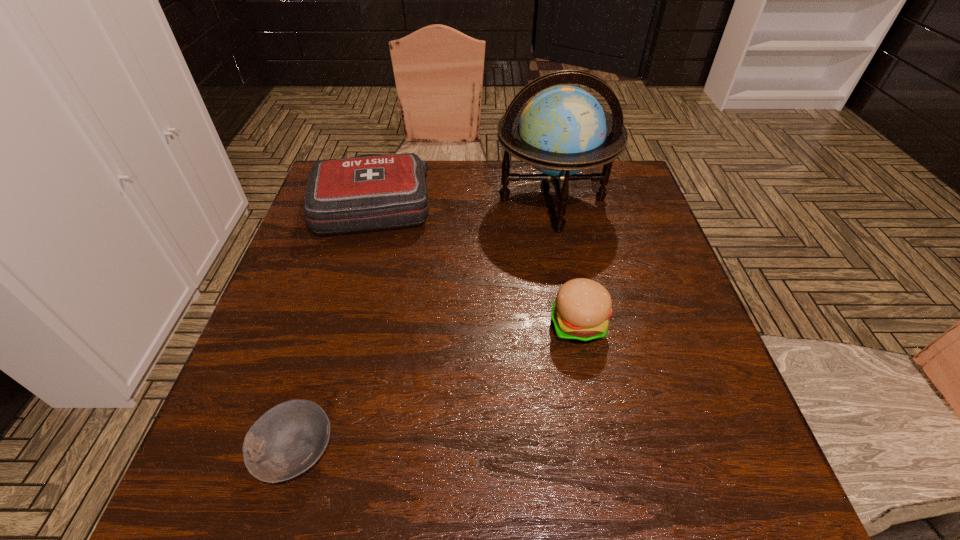
Where is `vacant region between the first-aid kit and the tallest object`? The image size is (960, 540). vacant region between the first-aid kit and the tallest object is located at coordinates (463, 201).

The width and height of the screenshot is (960, 540). In order to click on free area in between the hamburger and the tallest object in this screenshot , I will do `click(565, 262)`.

You are a GUI agent. You are given a task and a screenshot of the screen. Output one action in this format:
    pyautogui.click(x=<x>, y=<y>)
    Task: Click on the free space between the globe and the nearest object
    This screenshot has height=540, width=960.
    Given the screenshot: What is the action you would take?
    pyautogui.click(x=424, y=325)

Where is `free space between the first-aid kit and the second nearest object`? The height and width of the screenshot is (540, 960). free space between the first-aid kit and the second nearest object is located at coordinates (476, 264).

Identify which object is the third nearest to the first-aid kit. Please provide its 2D coordinates. Your answer should be formatted as a tuple, i.e. [(x, y)], where the tuple contains the x and y coordinates of a point satisfying the conditions above.

[(288, 439)]

Identify which object is the second nearest to the tallest object. Please provide its 2D coordinates. Your answer should be formatted as a tuple, i.e. [(x, y)], where the tuple contains the x and y coordinates of a point satisfying the conditions above.

[(580, 313)]

Where is `vacant space that satisfies the following two spatial constraints: 1. on the surface of the hamburger; 2. on the left side of the tallest object`? This screenshot has width=960, height=540. vacant space that satisfies the following two spatial constraints: 1. on the surface of the hamburger; 2. on the left side of the tallest object is located at coordinates (576, 325).

Find the location of `vacant region that satisfies the following two spatial constraints: 1. on the surface of the tallest object; 2. on the right side of the hamburger`. vacant region that satisfies the following two spatial constraints: 1. on the surface of the tallest object; 2. on the right side of the hamburger is located at coordinates (576, 325).

Identify the location of free location that satisfies the following two spatial constraints: 1. on the surface of the tallest object; 2. on the left side of the hamburger. The width and height of the screenshot is (960, 540). (576, 325).

Where is `free space that satisfies the following two spatial constraints: 1. on the surface of the globe; 2. on the left side of the third farthest object`? The width and height of the screenshot is (960, 540). free space that satisfies the following two spatial constraints: 1. on the surface of the globe; 2. on the left side of the third farthest object is located at coordinates (576, 325).